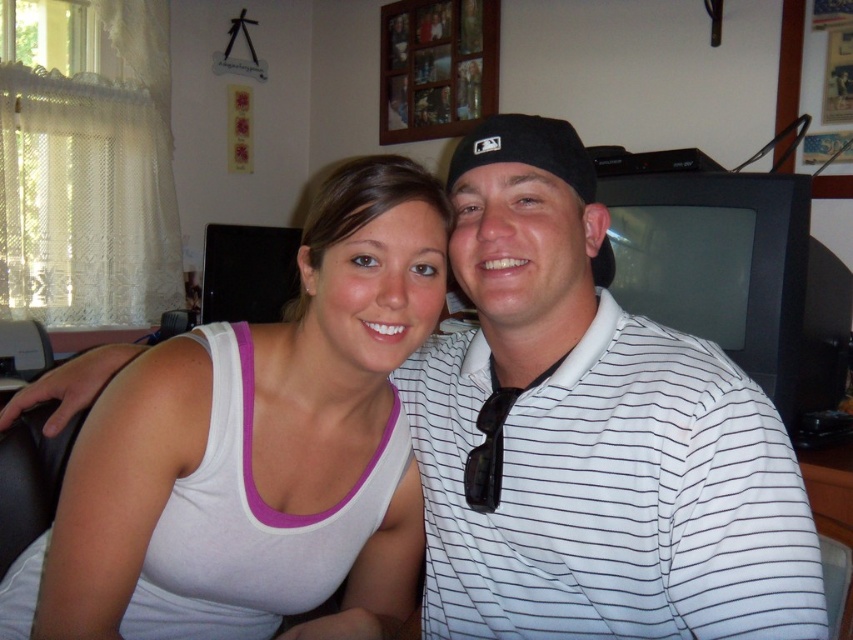
Question: Does white striped polo shirt at right come in front of white tank top at center?

Choices:
 (A) yes
 (B) no

Answer: (A)

Question: Which object appears closest to the camera in this image?

Choices:
 (A) white tank top at center
 (B) white striped polo shirt at right

Answer: (B)

Question: Can you confirm if white striped polo shirt at right is positioned to the left of white tank top at center?

Choices:
 (A) no
 (B) yes

Answer: (A)

Question: Can you confirm if white striped polo shirt at right is smaller than white tank top at center?

Choices:
 (A) yes
 (B) no

Answer: (A)

Question: Which point is farther from the camera taking this photo?

Choices:
 (A) (810, 616)
 (B) (363, 465)

Answer: (B)